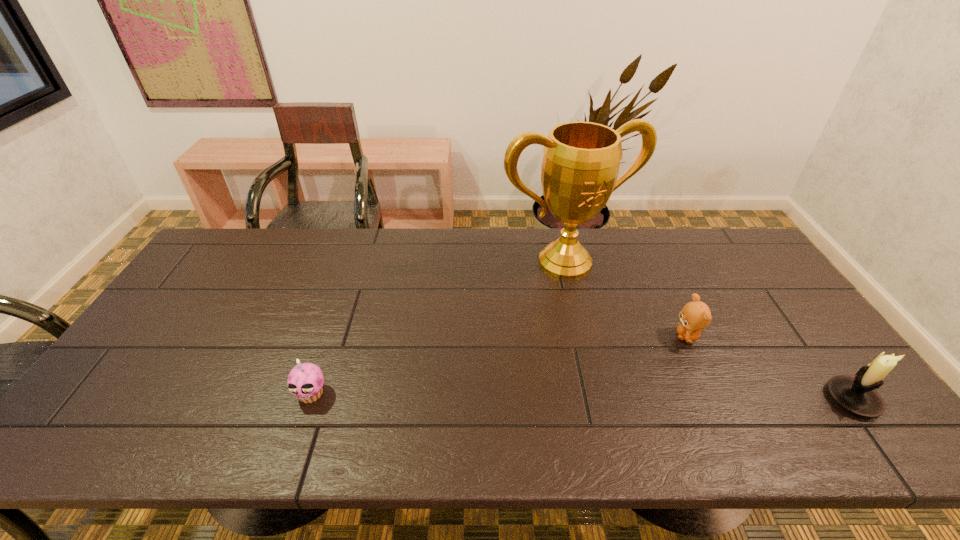
Image resolution: width=960 pixels, height=540 pixels. What are the coordinates of `free space on the desktop that is between the cupcake and the candle holder and is positioned on the front-facing side of the tallest object` in the screenshot? It's located at (657, 397).

Find the location of a particular element. vacant space on the desktop that is between the leftmost object and the second tallest object and is positioned on the face of the second farthest object is located at coordinates (659, 397).